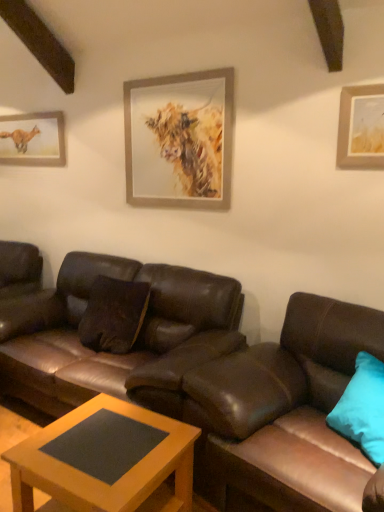
Find the location of a particular element. This screenshot has height=512, width=384. vacant space situated above wooden-framed painting of a cow at upper center, the first picture frame positioned from the right (from a real-world perspective) is located at coordinates (179, 69).